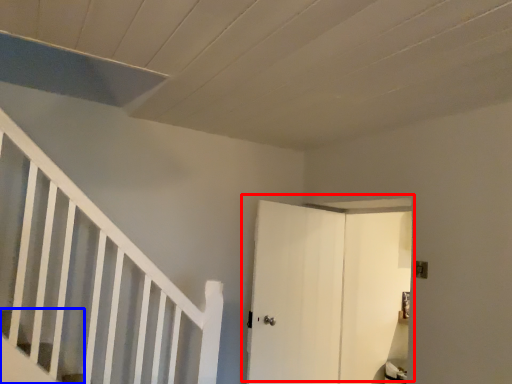
Question: Among these objects, which one is farthest to the camera, door (highlighted by a red box) or stairs (highlighted by a blue box)?

Choices:
 (A) door
 (B) stairs

Answer: (A)